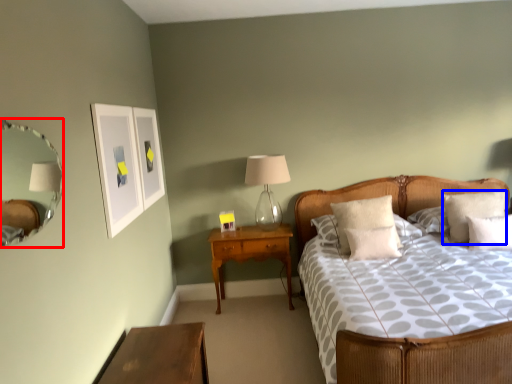
Question: Among these objects, which one is nearest to the camera, mirror (highlighted by a red box) or pillow (highlighted by a blue box)?

Choices:
 (A) mirror
 (B) pillow

Answer: (A)